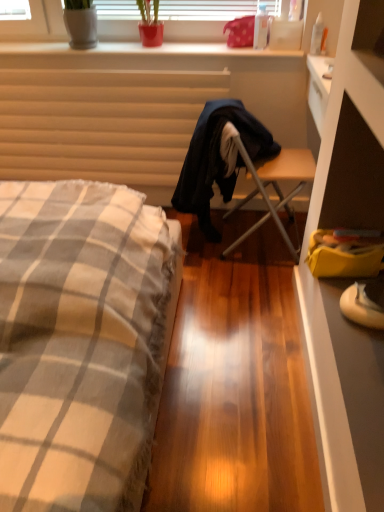
Identify the location of free space between wooden folding chair at center and dark blue fabric robe at center. The image size is (384, 512). (214, 259).